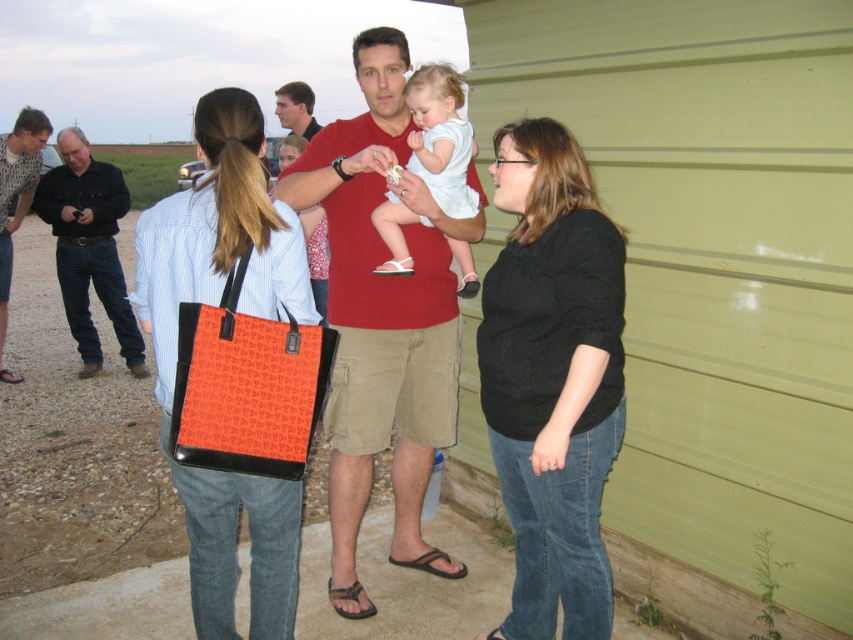
You are standing at point (126, 362) and want to walk to the green metal structure. There is a point at (567, 218) in your path. Will you have to walk around it or can you go straight?

The point at (567, 218) is in front of point (126, 362), so you will have to walk around it to reach the green metal structure.

You are trying to find the black cotton shirt at left in the image. Based on the scene description, where would you look relative to the black knit sweater at center?

The black knit sweater at center is positioned on the right side of the black cotton shirt at left, so the black cotton shirt at left is to the left of the black knit sweater at center.

You are standing in the rural area looking at the group of people near the green metal structure. There are two points marked in the image. Which point, point 1 at coordinates (x=53, y=228) or point 2 at coordinates (x=352, y=612), is closer to you?

Point 1 at coordinates (x=53, y=228) is closer to you because it is further to the viewer than point 2 at coordinates (x=352, y=612).